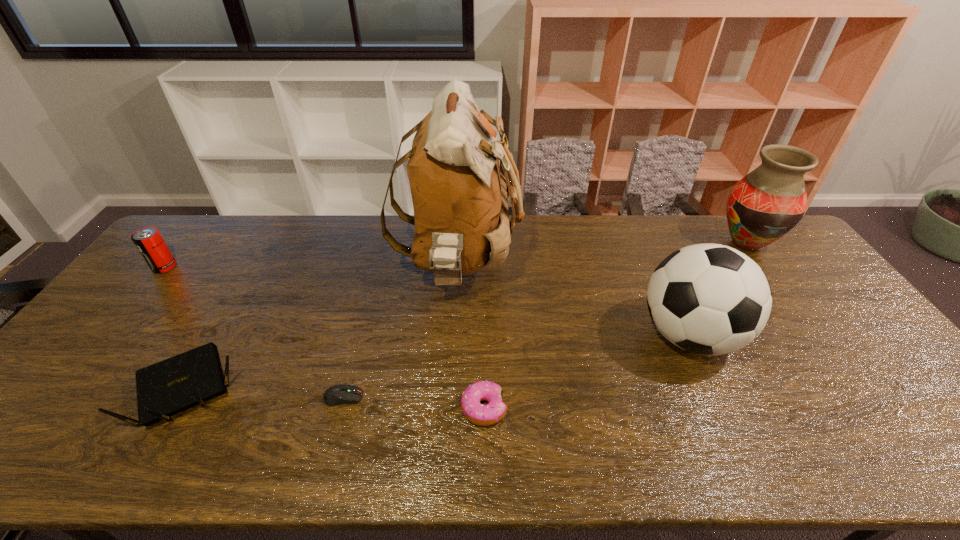
The image size is (960, 540). Find the location of `router present at the near edge`. router present at the near edge is located at coordinates (166, 388).

Image resolution: width=960 pixels, height=540 pixels. What are the coordinates of `doughnut positioned at the near edge` in the screenshot? It's located at (482, 415).

Identify the location of object at the left edge. The height and width of the screenshot is (540, 960). (149, 242).

Locate an element on the screen. The width and height of the screenshot is (960, 540). object at the right edge is located at coordinates [x=763, y=206].

Where is `object at the far right corner`? object at the far right corner is located at coordinates (763, 206).

This screenshot has height=540, width=960. Identify the location of vacant space at the far edge of the desktop. (588, 245).

Find the location of a particular element. vacant space at the near edge of the desktop is located at coordinates (563, 442).

Locate an element on the screen. The image size is (960, 540). free space at the right edge of the desktop is located at coordinates (846, 335).

Where is `vacant space at the far left corner of the desktop`? Image resolution: width=960 pixels, height=540 pixels. vacant space at the far left corner of the desktop is located at coordinates (184, 241).

Identify the location of vacant area between the soccer ball and the shortest object. (516, 366).